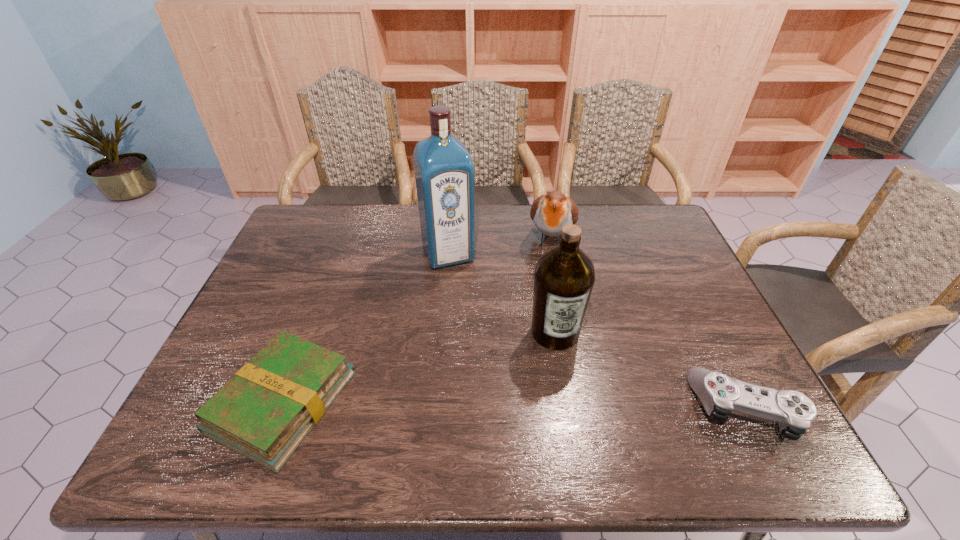
Identify the location of free spot on the desktop that is between the book and the rightmost object and is positioned at the face of the third shortest object. (523, 406).

You are a GUI agent. You are given a task and a screenshot of the screen. Output one action in this format:
    pyautogui.click(x=<x>, y=<y>)
    Task: Click on the free space on the desktop that is between the leftmost object and the control and is positioned on the flat label side of the fourth object from right to left
    
    Given the screenshot: What is the action you would take?
    pyautogui.click(x=511, y=405)

Locate an element on the screen. Image resolution: width=960 pixels, height=540 pixels. free space on the desktop that is between the book and the control and is positioned on the label of the olive oil is located at coordinates (573, 406).